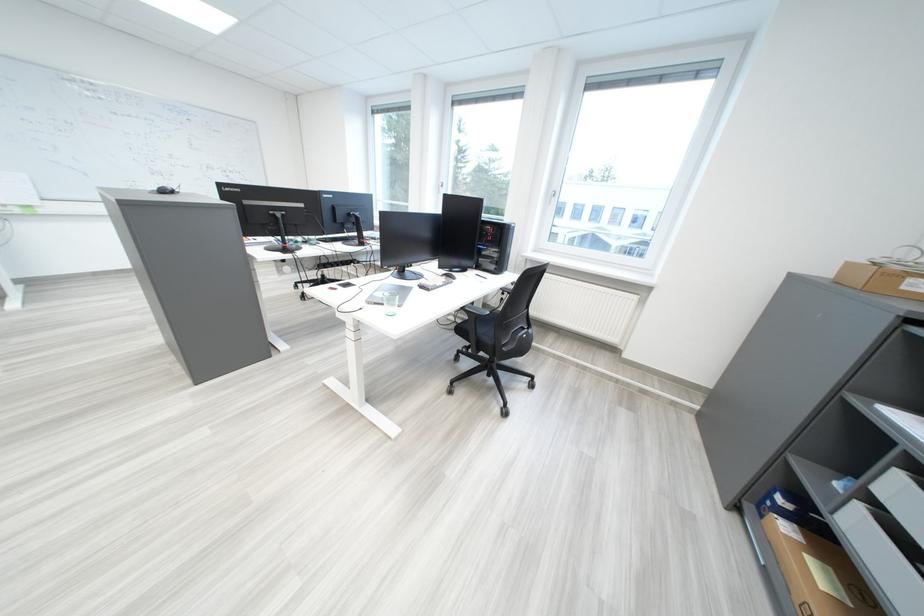
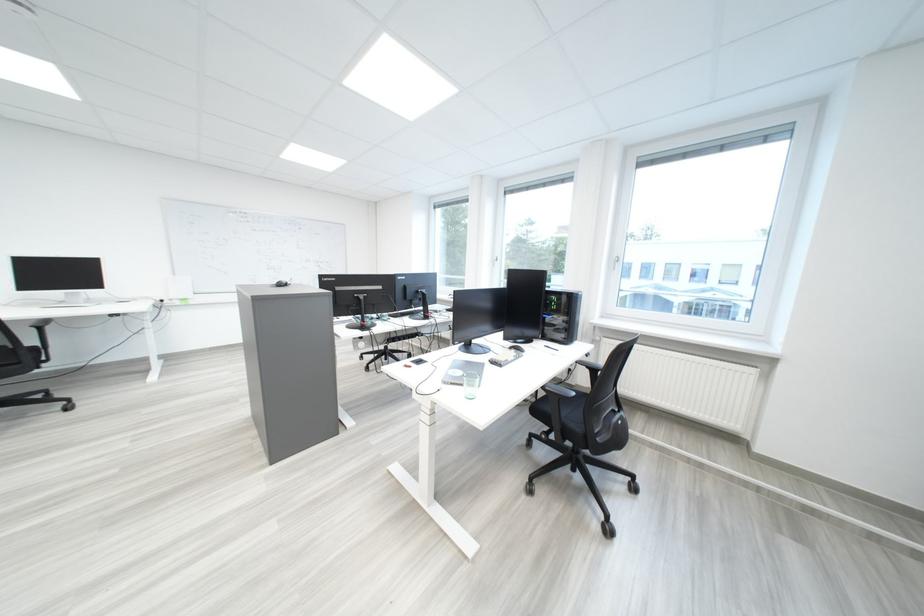
Question: Based on the continuous images, in which direction is the camera rotating? Reply with the corresponding letter.

Choices:
 (A) Left
 (B) Right
 (C) Up
 (D) Down

Answer: (C)